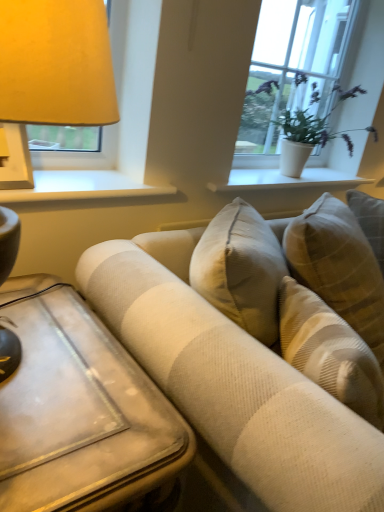
Find the location of a particular element. vacant space situated above white ceramic vase at upper center, marked as the first window sill in a back-to-front arrangement (from a real-world perspective) is located at coordinates (291, 174).